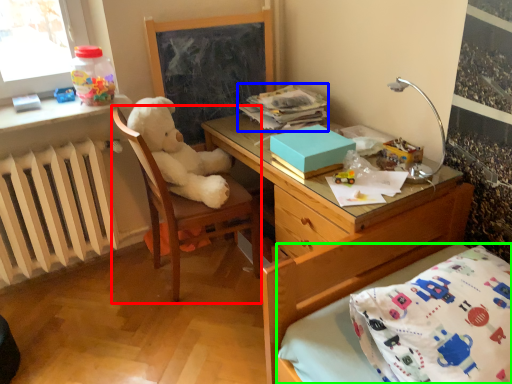
Question: Considering the real-world distances, which object is farthest from chair (highlighted by a red box)? book (highlighted by a blue box) or bed frame (highlighted by a green box)?

Choices:
 (A) book
 (B) bed frame

Answer: (B)